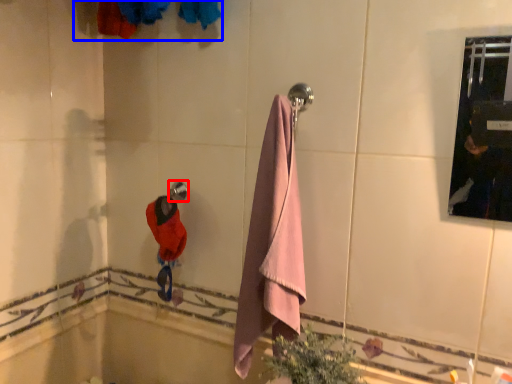
Question: Which point is further to the camera, towel bar (highlighted by a red box) or laundry (highlighted by a blue box)?

Choices:
 (A) towel bar
 (B) laundry

Answer: (A)